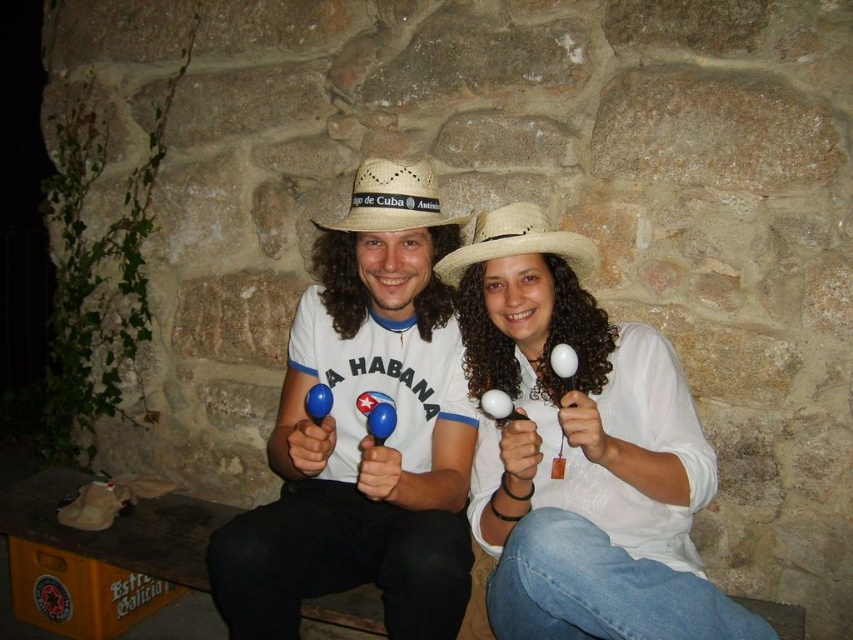
You are a photographer setting up a shot of two people sitting against a rustic stone wall. You notice the matte white shirt at center and the natural straw cowboy hat at center. Based on their positions, which object is closer to the camera?

The natural straw cowboy hat at center is closer to the camera because it is positioned above the matte white shirt at center, which is below it.

You are a photographer trying to capture the perfect shot of the matte white shirt at center and the beige straw cowboy hat at center. From which side of the scene should you position yourself to ensure both objects are fully visible in your frame?

To ensure both the matte white shirt at center and the beige straw cowboy hat at center are fully visible, position yourself to the right side of the scene. Since the matte white shirt at center is to the left of the beige straw cowboy hat at center, positioning yourself to the right will allow you to capture both objects within the frame without any overlap or obstruction.

You are a photographer trying to capture a portrait of the two people sitting against the rustic stone wall. You notice the matte white shirt at center and the beige straw cowboy hat at center. Which object should you focus on first if you want to ensure the taller one is in sharp focus?

The matte white shirt at center is taller than the beige straw cowboy hat at center, so you should focus on the matte white shirt at center first to ensure the taller object is in sharp focus.